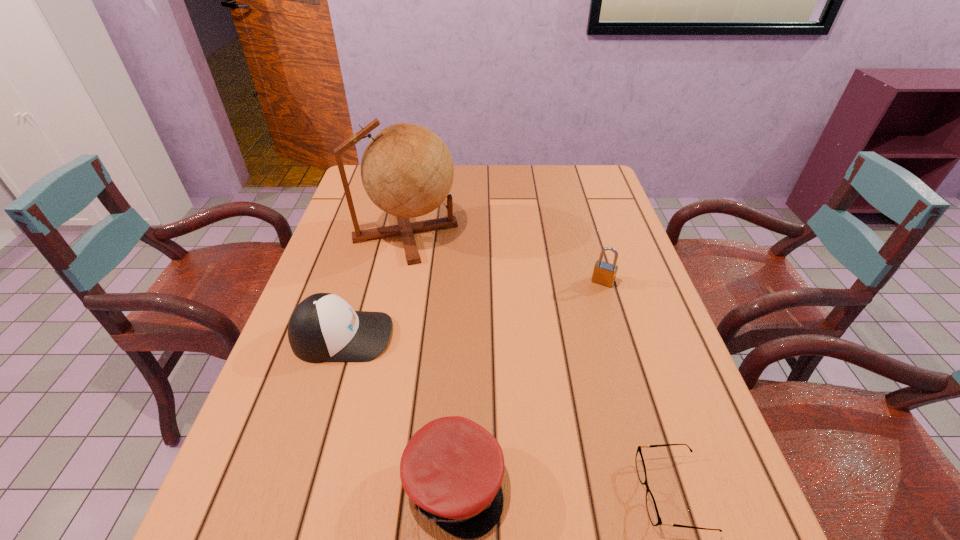
The width and height of the screenshot is (960, 540). Find the location of `spectacles located in the right edge section of the desktop`. spectacles located in the right edge section of the desktop is located at coordinates (652, 509).

The width and height of the screenshot is (960, 540). What are the coordinates of `object situated at the near right corner` in the screenshot? It's located at (652, 509).

The image size is (960, 540). What are the coordinates of `vacant space at the far edge` in the screenshot? It's located at (468, 193).

Where is `free space at the left edge`? This screenshot has width=960, height=540. free space at the left edge is located at coordinates (360, 256).

Identify the location of vacant space at the right edge of the desktop. The height and width of the screenshot is (540, 960). (593, 239).

Image resolution: width=960 pixels, height=540 pixels. Find the location of `vacant area that lies between the padlock and the left cap`. vacant area that lies between the padlock and the left cap is located at coordinates pos(472,309).

What are the coordinates of `vacant area that lies between the padlock and the second shortest object` in the screenshot? It's located at (528, 383).

Identify the location of empty location between the fourth nearest object and the left cap. (472, 309).

Image resolution: width=960 pixels, height=540 pixels. What are the coordinates of `unoccupied area between the farther cap and the spectacles` in the screenshot? It's located at (508, 414).

The height and width of the screenshot is (540, 960). I want to click on vacant space that's between the spectacles and the farther cap, so click(508, 414).